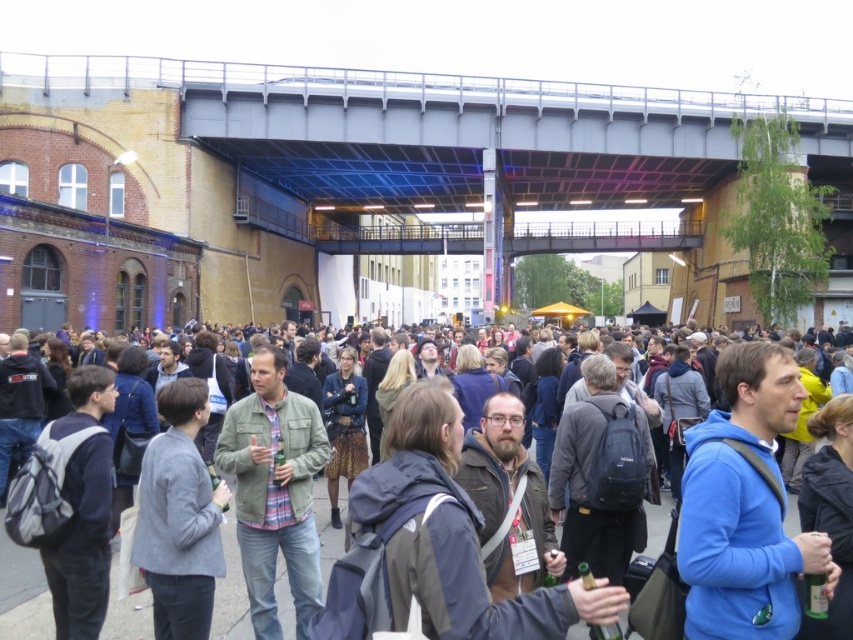
Question: Can you confirm if metallic gray bridge at center is positioned below green matte jacket at center?

Choices:
 (A) yes
 (B) no

Answer: (B)

Question: Which of these objects is positioned farthest from the dark gray casual clothing at center?

Choices:
 (A) green matte jacket at center
 (B) metallic gray bridge at center

Answer: (B)

Question: Can you confirm if green matte jacket at center is positioned to the right of dark gray casual clothing at center?

Choices:
 (A) no
 (B) yes

Answer: (A)

Question: Which object is positioned closest to the metallic gray bridge at center?

Choices:
 (A) green matte jacket at center
 (B) dark gray casual clothing at center

Answer: (B)

Question: Observing the image, what is the correct spatial positioning of metallic gray bridge at center in reference to green matte jacket at center?

Choices:
 (A) below
 (B) above

Answer: (B)

Question: Which of the following is the farthest from the observer?

Choices:
 (A) dark gray casual clothing at center
 (B) green matte jacket at center
 (C) metallic gray bridge at center

Answer: (C)